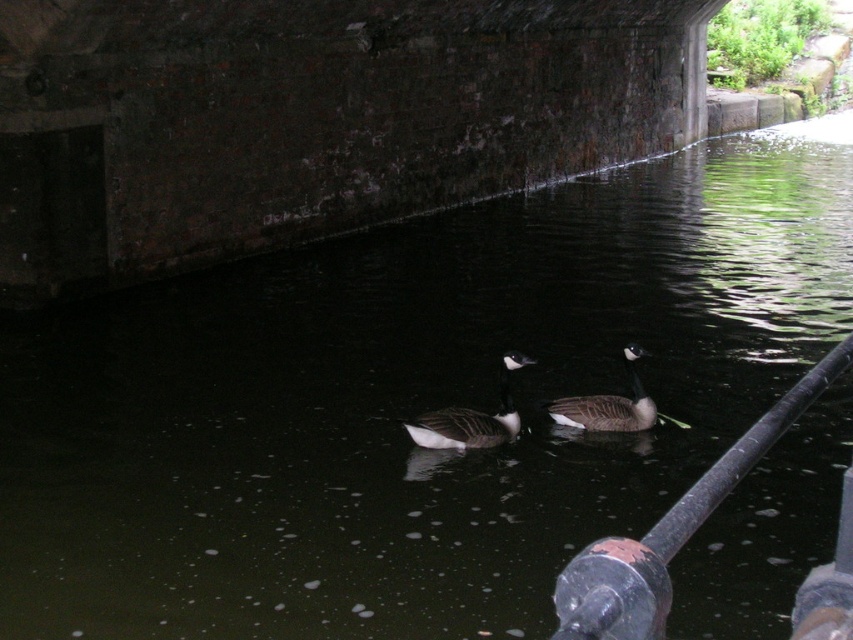
Question: Which point is farther to the camera?

Choices:
 (A) (635, 541)
 (B) (631, 428)

Answer: (B)

Question: Can you confirm if white matte duck at center is positioned below dark gray matte duck at center?

Choices:
 (A) no
 (B) yes

Answer: (B)

Question: Which object is positioned farthest from the white matte duck at center?

Choices:
 (A) black metal rail at lower right
 (B) dark gray matte duck at center

Answer: (A)

Question: Does black metal rail at lower right appear on the right side of white matte duck at center?

Choices:
 (A) no
 (B) yes

Answer: (B)

Question: Among these points, which one is farthest from the camera?

Choices:
 (A) (575, 614)
 (B) (462, 419)
 (C) (592, 412)

Answer: (C)

Question: Can you confirm if white matte duck at center is positioned above dark gray matte duck at center?

Choices:
 (A) yes
 (B) no

Answer: (B)